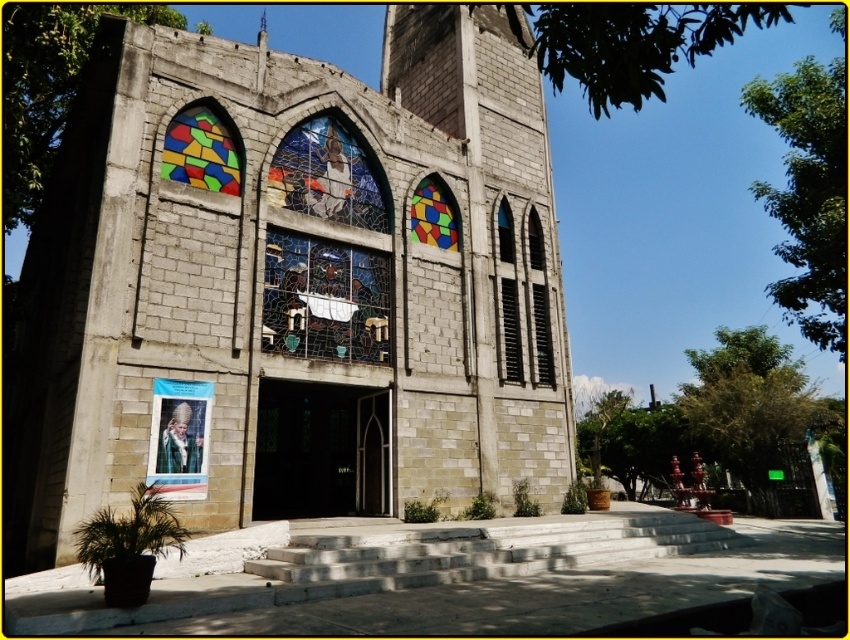
The width and height of the screenshot is (850, 640). What do you see at coordinates (320, 451) in the screenshot? I see `black glass door at center` at bounding box center [320, 451].

Who is higher up, black glass door at center or stained glass window at upper center?

stained glass window at upper center is above.

Where is `black glass door at center`? This screenshot has height=640, width=850. black glass door at center is located at coordinates [x=320, y=451].

This screenshot has height=640, width=850. What are the coordinates of `black glass door at center` in the screenshot? It's located at (320, 451).

Is gray stone church at center to the right of black glass door at center from the viewer's perspective?

Yes, gray stone church at center is to the right of black glass door at center.

At what (x,y) coordinates should I click in order to perform the action: click on gray stone church at center. Please return your answer as a coordinate pair (x, y). Looking at the image, I should click on (293, 288).

Does gray stone church at center have a smaller size compared to stained glass window at center?

No.

Is gray stone church at center wider than stained glass window at center?

Indeed, gray stone church at center has a greater width compared to stained glass window at center.

Is point (293, 508) farther from viewer compared to point (374, 298)?

Yes, it is.

Find the location of `gray stone church at center`. gray stone church at center is located at coordinates (293, 288).